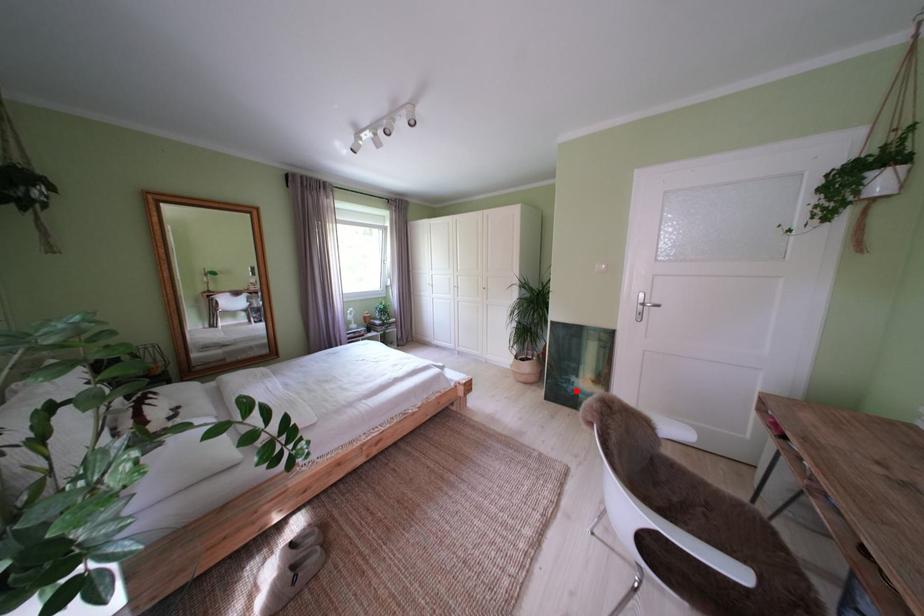
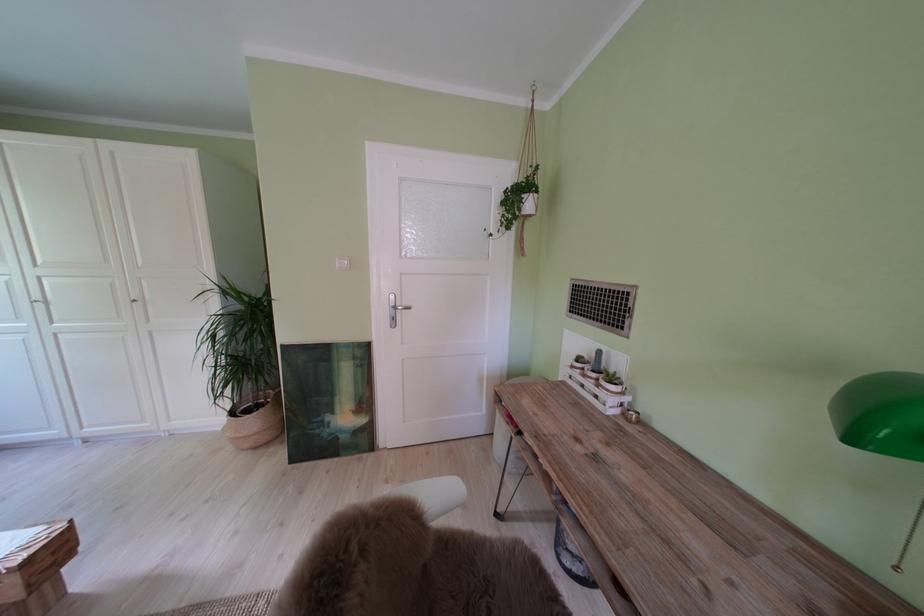
Question: I am providing you with two images of the same scene from different viewpoints. A red point is marked on the first image. At the location where the point appears in image 1, is it still visible in image 2?

Choices:
 (A) Yes
 (B) No

Answer: (A)